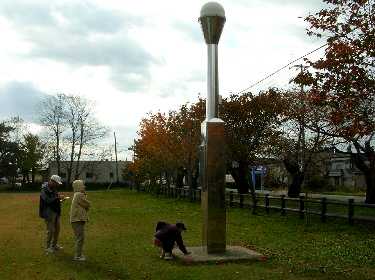
Where is `light`? light is located at coordinates (218, 75).